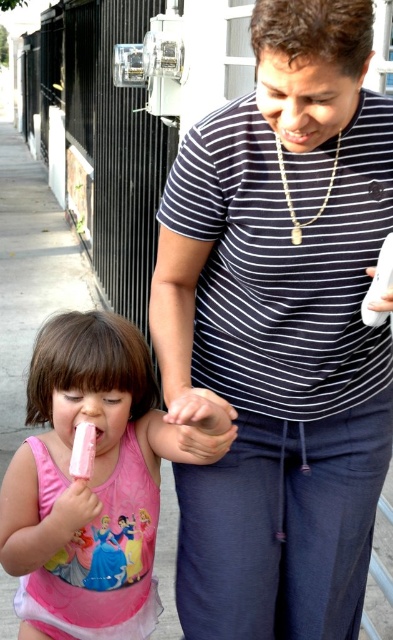
Question: Which point is closer to the camera?

Choices:
 (A) (288, 321)
 (B) (167, 456)

Answer: (A)

Question: Which of the following is the closest to the observer?

Choices:
 (A) pink matte swimsuit at lower left
 (B) striped cotton shirt at center

Answer: (B)

Question: Can you confirm if striped cotton shirt at center is positioned to the right of pink matte swimsuit at lower left?

Choices:
 (A) no
 (B) yes

Answer: (B)

Question: Is striped cotton shirt at center above pink matte swimsuit at lower left?

Choices:
 (A) no
 (B) yes

Answer: (B)

Question: Is striped cotton shirt at center thinner than pink matte swimsuit at lower left?

Choices:
 (A) no
 (B) yes

Answer: (B)